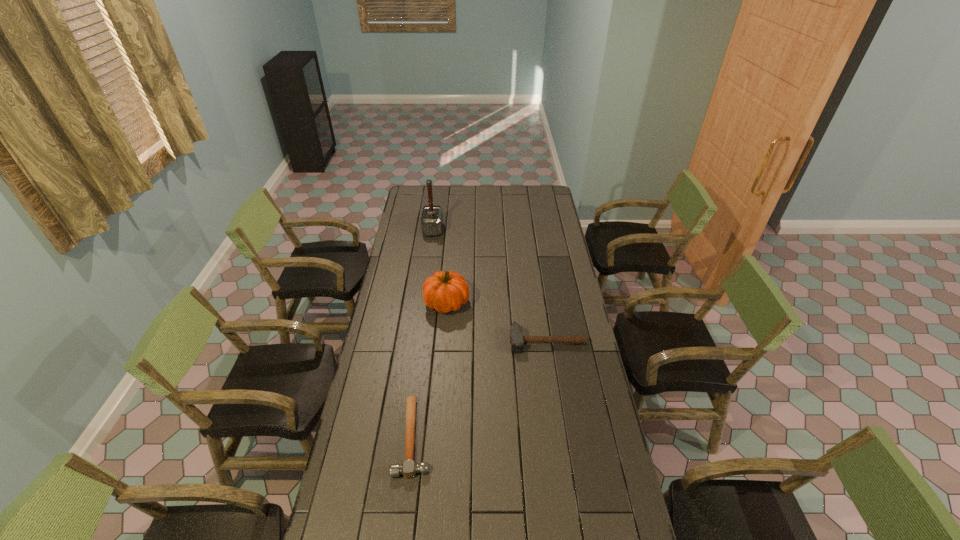
Identify which hammer is the second closest to the tallest hammer. Please provide its 2D coordinates. Your answer should be formatted as a tuple, i.e. [(x, y)], where the tuple contains the x and y coordinates of a point satisfying the conditions above.

[(409, 468)]